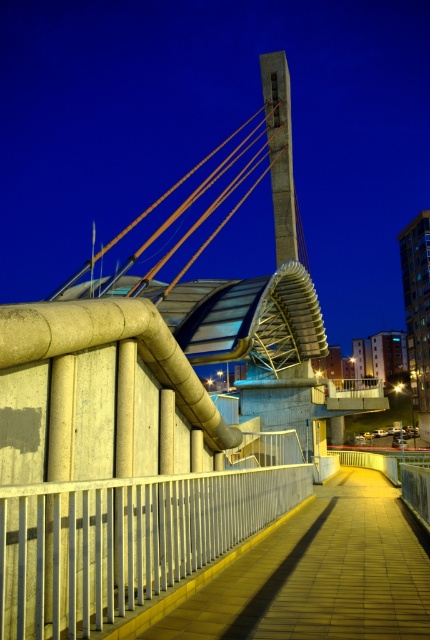
Which is below, silver metallic railing at center or yellow concrete path at center?

yellow concrete path at center is lower down.

Between point (12, 618) and point (396, 541), which one is positioned in front?

Positioned in front is point (12, 618).

Image resolution: width=430 pixels, height=640 pixels. I want to click on silver metallic railing at center, so click(x=125, y=540).